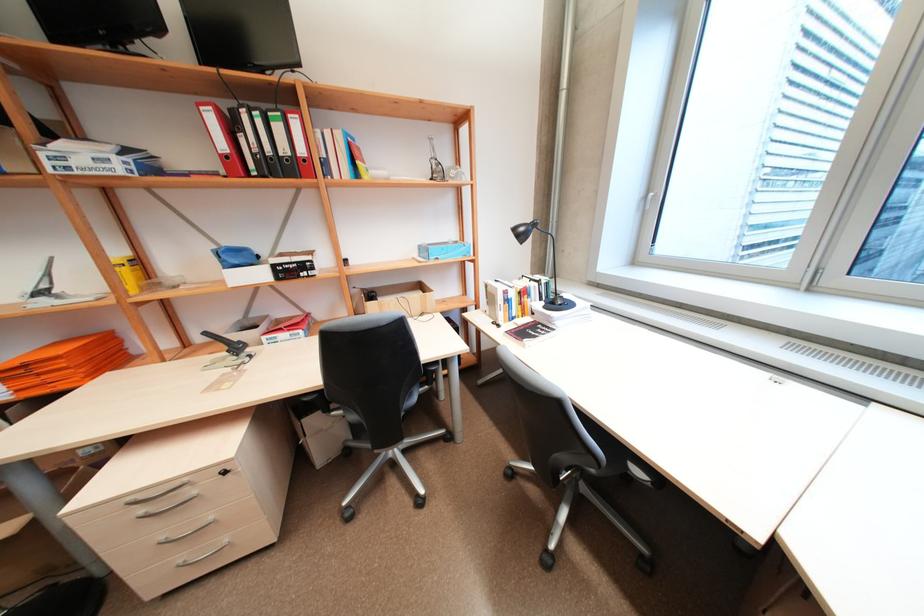
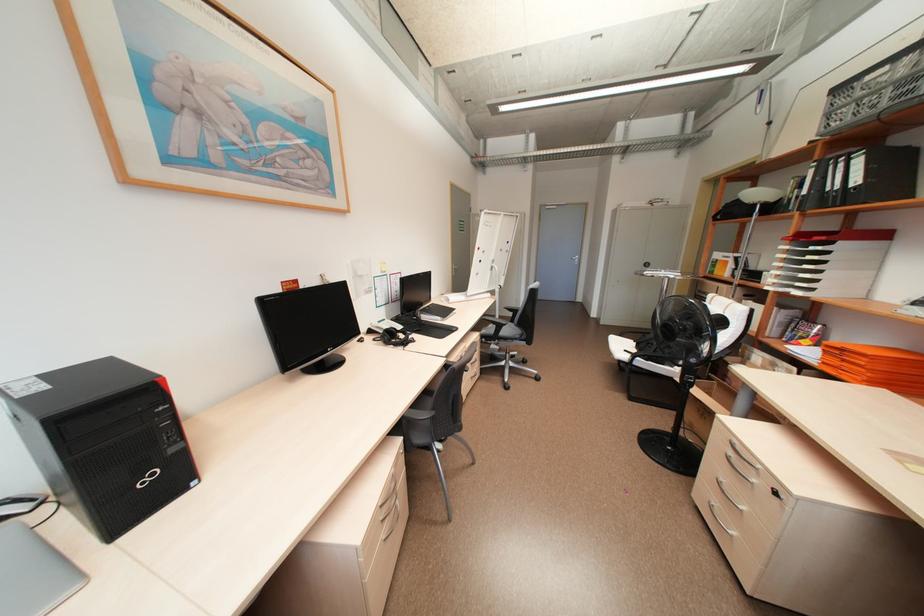
Where in the second image is the point corresponding to the point at 149,511 from the first image?

(736, 453)